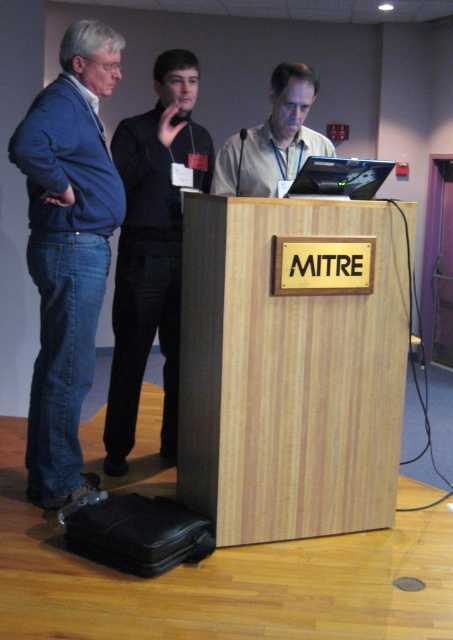
Question: Can you confirm if black cotton shirt at left is wider than matte light brown laptop at center?

Choices:
 (A) no
 (B) yes

Answer: (A)

Question: Which object appears farthest from the camera in this image?

Choices:
 (A) wooden podium at center
 (B) black cotton shirt at left
 (C) matte light brown laptop at center

Answer: (B)

Question: Which point appears closest to the camera in this image?

Choices:
 (A) (249, 141)
 (B) (78, 291)
 (C) (187, 160)

Answer: (B)

Question: Estimate the real-world distances between objects in this image. Which object is closer to the wooden podium at center?

Choices:
 (A) blue denim jeans at left
 (B) matte light brown laptop at center

Answer: (A)

Question: Is wooden podium at center smaller than black cotton shirt at left?

Choices:
 (A) no
 (B) yes

Answer: (A)

Question: Is blue denim jeans at left above black cotton shirt at left?

Choices:
 (A) yes
 (B) no

Answer: (B)